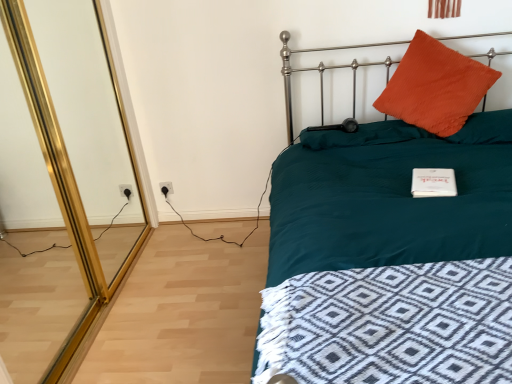
Question: Is orange fuzzy pillow at upper right, which is the 1th pillow from left to right, aimed at teal fabric bed at upper right?

Choices:
 (A) yes
 (B) no

Answer: (A)

Question: Can you confirm if orange fuzzy pillow at upper right, which is the 1th pillow from left to right, is smaller than teal fabric bed at upper right?

Choices:
 (A) no
 (B) yes

Answer: (B)

Question: Is orange fuzzy pillow at upper right, which is the 1th pillow from left to right, shorter than teal fabric bed at upper right?

Choices:
 (A) yes
 (B) no

Answer: (A)

Question: From a real-world perspective, is orange fuzzy pillow at upper right, acting as the 3th pillow starting from the right, beneath teal fabric bed at upper right?

Choices:
 (A) yes
 (B) no

Answer: (B)

Question: Can you confirm if orange fuzzy pillow at upper right, which is the 1th pillow from left to right, is wider than teal fabric bed at upper right?

Choices:
 (A) no
 (B) yes

Answer: (A)

Question: From the image's perspective, would you say orange fuzzy pillow at upper right, acting as the 3th pillow starting from the right, is shown under teal fabric bed at upper right?

Choices:
 (A) no
 (B) yes

Answer: (A)

Question: Does white plastic electric outlet at lower left have a larger size compared to orange fuzzy pillow at upper right, which is the 1th pillow from left to right?

Choices:
 (A) yes
 (B) no

Answer: (B)

Question: Is white plastic electric outlet at lower left looking in the opposite direction of orange fuzzy pillow at upper right, which is the 1th pillow from left to right?

Choices:
 (A) no
 (B) yes

Answer: (A)

Question: Is white plastic electric outlet at lower left shorter than orange fuzzy pillow at upper right, acting as the 3th pillow starting from the right?

Choices:
 (A) yes
 (B) no

Answer: (B)

Question: Would you say white plastic electric outlet at lower left is outside orange fuzzy pillow at upper right, acting as the 3th pillow starting from the right?

Choices:
 (A) no
 (B) yes

Answer: (B)

Question: Is white plastic electric outlet at lower left at the right side of orange fuzzy pillow at upper right, acting as the 3th pillow starting from the right?

Choices:
 (A) yes
 (B) no

Answer: (B)

Question: Does white plastic electric outlet at lower left have a smaller size compared to orange fuzzy pillow at upper right, which is the 1th pillow from left to right?

Choices:
 (A) no
 (B) yes

Answer: (B)

Question: From the image's perspective, is orange corduroy pillow at upper right, the 1th pillow from the right, on top of teal fabric bed at upper right?

Choices:
 (A) no
 (B) yes

Answer: (B)